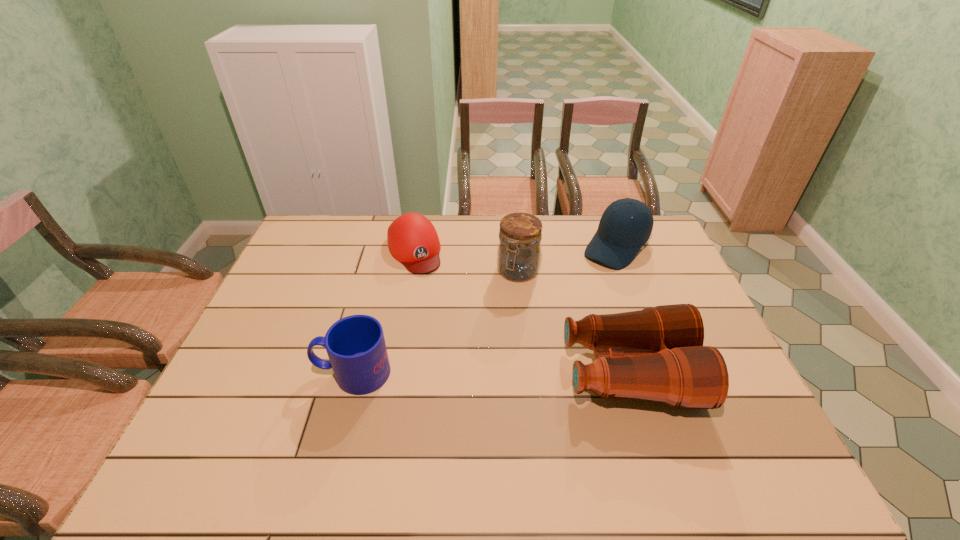
I want to click on mug, so click(356, 347).

I want to click on binoculars, so click(656, 354).

In order to click on the left baseball cap in this screenshot , I will do `click(412, 239)`.

The width and height of the screenshot is (960, 540). In order to click on the shortest object in this screenshot , I will do `click(412, 239)`.

Identify the location of the right baseball cap. (619, 237).

I want to click on the tallest object, so click(519, 251).

Image resolution: width=960 pixels, height=540 pixels. Identify the location of the third object from right to left. (519, 251).

The height and width of the screenshot is (540, 960). Find the location of `free location located on the side with the handle of the mug`. free location located on the side with the handle of the mug is located at coordinates (259, 373).

Locate an element on the screen. The height and width of the screenshot is (540, 960). vacant space situated 0.230m on the side with the handle of the mug is located at coordinates (228, 373).

Where is `blank space located 0.100m on the side with the handle of the mug`? blank space located 0.100m on the side with the handle of the mug is located at coordinates (278, 373).